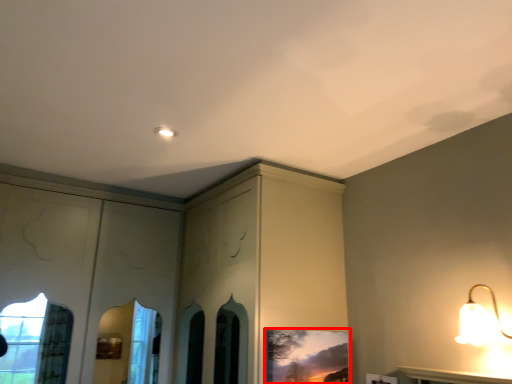
Question: From the image, what is the correct spatial relationship of picture frame (annotated by the red box) in relation to lamp?

Choices:
 (A) left
 (B) right

Answer: (A)